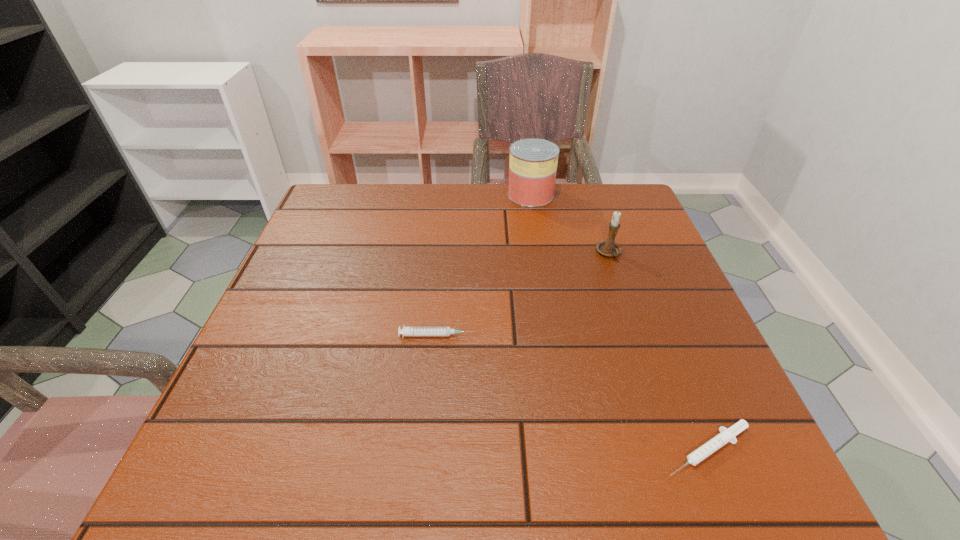
The width and height of the screenshot is (960, 540). I want to click on free region that satisfies the following two spatial constraints: 1. on the front side of the can; 2. at the needle end of the second nearest object, so click(x=553, y=335).

I want to click on free space that satisfies the following two spatial constraints: 1. on the side of the third shortest object with the handle; 2. at the needle end of the left syringe, so click(x=637, y=335).

Find the location of a particular element. This screenshot has height=540, width=960. vacant space that satisfies the following two spatial constraints: 1. on the side of the second tallest object with the handle; 2. at the needle end of the third farthest object is located at coordinates (637, 335).